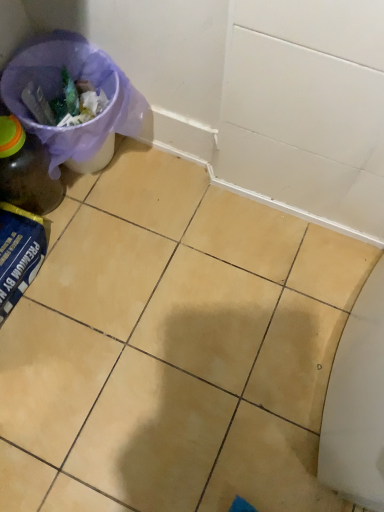
Question: Is matte glass bottle at left inside yellow matte tile at center?

Choices:
 (A) yes
 (B) no

Answer: (B)

Question: From a real-world perspective, is yellow matte tile at center beneath matte glass bottle at left?

Choices:
 (A) no
 (B) yes

Answer: (B)

Question: Does yellow matte tile at center have a lesser width compared to matte glass bottle at left?

Choices:
 (A) no
 (B) yes

Answer: (A)

Question: Considering the relative sizes of yellow matte tile at center and matte glass bottle at left in the image provided, is yellow matte tile at center taller than matte glass bottle at left?

Choices:
 (A) no
 (B) yes

Answer: (A)

Question: Considering the relative sizes of yellow matte tile at center and matte glass bottle at left in the image provided, is yellow matte tile at center bigger than matte glass bottle at left?

Choices:
 (A) no
 (B) yes

Answer: (B)

Question: From the image's perspective, is yellow matte tile at center located above matte glass bottle at left?

Choices:
 (A) no
 (B) yes

Answer: (A)

Question: Is purple fabric bag at upper left closer to the viewer compared to yellow matte tile at center?

Choices:
 (A) no
 (B) yes

Answer: (A)

Question: Is purple fabric bag at upper left surrounding yellow matte tile at center?

Choices:
 (A) no
 (B) yes

Answer: (A)

Question: Does purple fabric bag at upper left have a smaller size compared to yellow matte tile at center?

Choices:
 (A) yes
 (B) no

Answer: (A)

Question: Is purple fabric bag at upper left not close to yellow matte tile at center?

Choices:
 (A) yes
 (B) no

Answer: (B)

Question: Is purple fabric bag at upper left behind yellow matte tile at center?

Choices:
 (A) yes
 (B) no

Answer: (A)

Question: From a real-world perspective, is purple fabric bag at upper left below yellow matte tile at center?

Choices:
 (A) no
 (B) yes

Answer: (A)

Question: From a real-world perspective, is yellow matte tile at center on purple fabric bag at upper left?

Choices:
 (A) yes
 (B) no

Answer: (B)